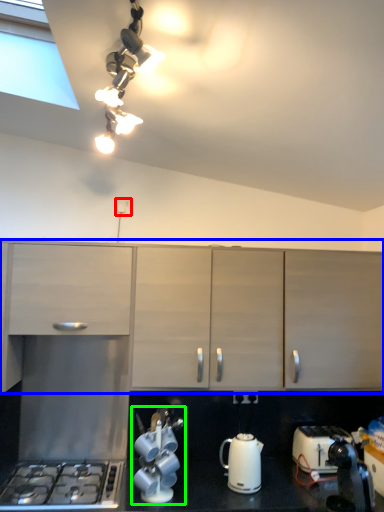
Question: Based on their relative distances, which object is farther from electric outlet (highlighted by a red box)? Choose from cabinetry (highlighted by a blue box) and tea set (highlighted by a green box).

Choices:
 (A) cabinetry
 (B) tea set

Answer: (B)